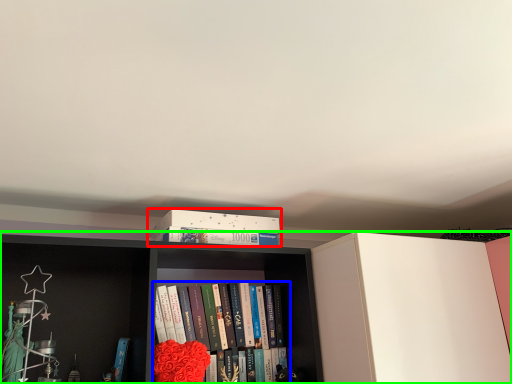
Question: Which is nearer to the book cover (highlighted by a red box)? book (highlighted by a blue box) or bookcase (highlighted by a green box).

Choices:
 (A) book
 (B) bookcase

Answer: (B)